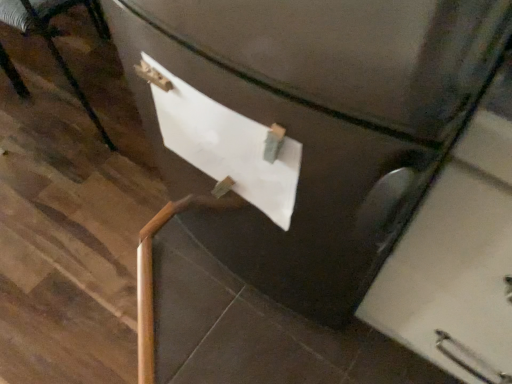
The height and width of the screenshot is (384, 512). In order to click on white matte paper at center in this screenshot , I will do `click(226, 144)`.

This screenshot has height=384, width=512. Describe the element at coordinates (226, 144) in the screenshot. I see `white matte paper at center` at that location.

What do you see at coordinates (55, 36) in the screenshot? Image resolution: width=512 pixels, height=384 pixels. I see `brushed metal chair at lower left` at bounding box center [55, 36].

The image size is (512, 384). I want to click on brushed metal chair at lower left, so click(x=55, y=36).

At what (x,y) coordinates should I click in order to perform the action: click on white matte paper at center. Please return your answer as a coordinate pair (x, y). Image resolution: width=512 pixels, height=384 pixels. Looking at the image, I should click on (226, 144).

Is brushed metal chair at lower left to the left of white matte paper at center from the viewer's perspective?

Correct, you'll find brushed metal chair at lower left to the left of white matte paper at center.

Which object is further away from the camera taking this photo, brushed metal chair at lower left or white matte paper at center?

brushed metal chair at lower left is more distant.

Between point (32, 10) and point (189, 151), which one is positioned in front?

The point (189, 151) is more forward.

From the image's perspective, is brushed metal chair at lower left under white matte paper at center?

No, from the image's perspective, brushed metal chair at lower left is not beneath white matte paper at center.

From a real-world perspective, who is located higher, brushed metal chair at lower left or white matte paper at center?

From a 3D spatial view, white matte paper at center is above.

Considering the sizes of objects brushed metal chair at lower left and white matte paper at center in the image provided, who is wider, brushed metal chair at lower left or white matte paper at center?

brushed metal chair at lower left.

Is brushed metal chair at lower left taller than white matte paper at center?

Yes.

In the scene shown: In terms of size, does brushed metal chair at lower left appear bigger or smaller than white matte paper at center?

Considering their sizes, brushed metal chair at lower left takes up more space than white matte paper at center.

Would you say brushed metal chair at lower left is outside white matte paper at center?

Indeed, brushed metal chair at lower left is completely outside white matte paper at center.

Is brushed metal chair at lower left far from white matte paper at center?

Actually, brushed metal chair at lower left and white matte paper at center are a little close together.

Is brushed metal chair at lower left oriented towards white matte paper at center?

Yes, brushed metal chair at lower left faces towards white matte paper at center.

The width and height of the screenshot is (512, 384). I want to click on paper in front of the brushed metal chair at lower left, so click(x=226, y=144).

Considering the relative positions of white matte paper at center and brushed metal chair at lower left in the image provided, is white matte paper at center to the left of brushed metal chair at lower left from the viewer's perspective?

Incorrect, white matte paper at center is not on the left side of brushed metal chair at lower left.

Which object is more forward, white matte paper at center or brushed metal chair at lower left?

white matte paper at center is more forward.

Is point (255, 156) behind point (98, 4)?

No, it is in front of (98, 4).

From the image's perspective, who appears lower, white matte paper at center or brushed metal chair at lower left?

From the image's view, white matte paper at center is below.

From a real-world perspective, relative to brushed metal chair at lower left, is white matte paper at center vertically above or below?

white matte paper at center is above brushed metal chair at lower left.

Can you confirm if white matte paper at center is wider than brushed metal chair at lower left?

Incorrect, the width of white matte paper at center does not surpass that of brushed metal chair at lower left.

Looking at this image, does white matte paper at center have a lesser height compared to brushed metal chair at lower left?

Correct, white matte paper at center is not as tall as brushed metal chair at lower left.

Between white matte paper at center and brushed metal chair at lower left, which one has larger size?

With larger size is brushed metal chair at lower left.

Would you say white matte paper at center is inside or outside brushed metal chair at lower left?

white matte paper at center is outside brushed metal chair at lower left.

Are white matte paper at center and brushed metal chair at lower left located far from each other?

No, white matte paper at center is not far away from brushed metal chair at lower left.

Could you tell me if white matte paper at center is facing brushed metal chair at lower left?

No, white matte paper at center does not turn towards brushed metal chair at lower left.

Where is `paper in front of the brushed metal chair at lower left`? paper in front of the brushed metal chair at lower left is located at coordinates [226, 144].

Where is `paper in front of the brushed metal chair at lower left`? The width and height of the screenshot is (512, 384). paper in front of the brushed metal chair at lower left is located at coordinates (226, 144).

The image size is (512, 384). Find the location of `furniture directly beneath the white matte paper at center (from a real-world perspective)`. furniture directly beneath the white matte paper at center (from a real-world perspective) is located at coordinates (55, 36).